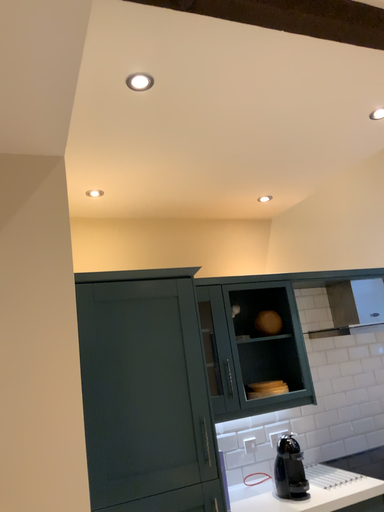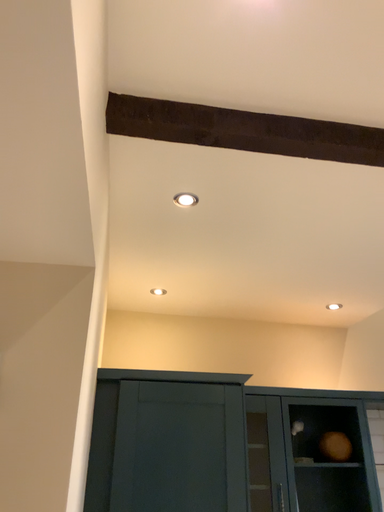
Question: How did the camera likely rotate when shooting the video?

Choices:
 (A) rotated downward
 (B) rotated upward

Answer: (B)